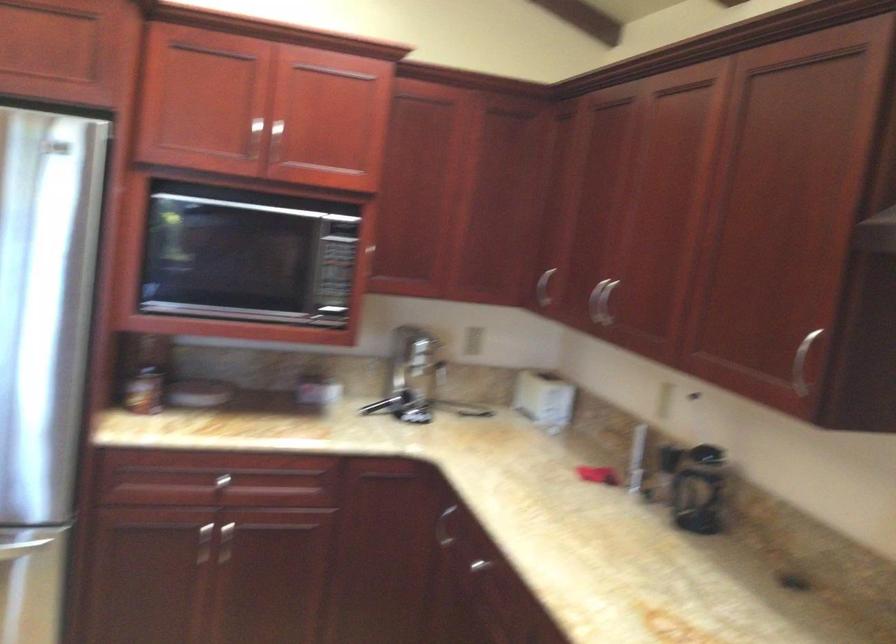
The width and height of the screenshot is (896, 644). What do you see at coordinates (21, 547) in the screenshot? I see `the refrigerator handle` at bounding box center [21, 547].